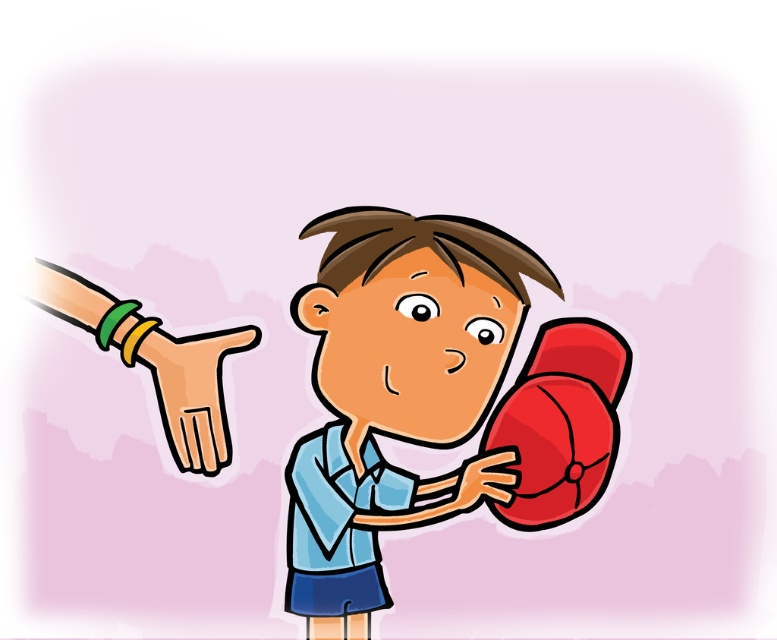
Describe the element at coordinates (392, 388) in the screenshot. The height and width of the screenshot is (640, 777). I see `smooth blue shirt at center` at that location.

Is point (416, 266) positioned in front of point (612, 365)?

No, it is behind (612, 365).

The height and width of the screenshot is (640, 777). Identify the location of smooth blue shirt at center. (392, 388).

Who is positioned more to the right, smooth blue shirt at center or rubber glove at lower right?

rubber glove at lower right is more to the right.

Is smooth blue shirt at center shorter than rubber glove at lower right?

In fact, smooth blue shirt at center may be taller than rubber glove at lower right.

Describe the element at coordinates (392, 388) in the screenshot. I see `smooth blue shirt at center` at that location.

Locate an element on the screen. The height and width of the screenshot is (640, 777). smooth blue shirt at center is located at coordinates tap(392, 388).

Does smooth blue shirt at center appear on the right side of red matte boxing glove at left?

Yes, smooth blue shirt at center is to the right of red matte boxing glove at left.

Can you confirm if smooth blue shirt at center is positioned above red matte boxing glove at left?

No, smooth blue shirt at center is not above red matte boxing glove at left.

Is point (345, 392) positioned before point (190, 456)?

No, it is behind (190, 456).

I want to click on smooth blue shirt at center, so click(392, 388).